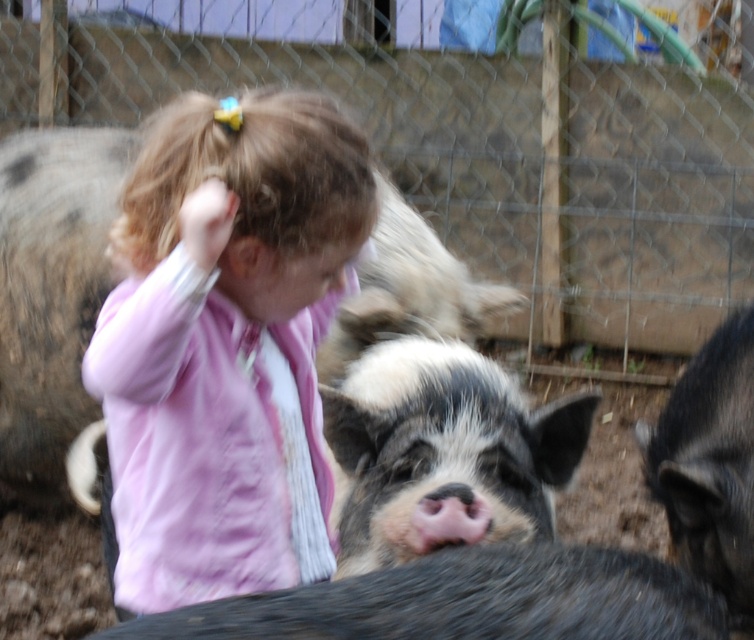
Between black fuzzy pig at center and black fuzzy pig at lower right, which one is positioned higher?

black fuzzy pig at lower right is higher up.

Is black fuzzy pig at center taller than black fuzzy pig at lower right?

No, black fuzzy pig at center is not taller than black fuzzy pig at lower right.

Who is more distant from viewer, (287, 632) or (722, 452)?

Positioned behind is point (722, 452).

Image resolution: width=754 pixels, height=640 pixels. Identify the location of black fuzzy pig at center. (466, 602).

Who is shorter, pink fabric at center or black fuzzy pig at center?

black fuzzy pig at center is shorter.

Can you confirm if pink fabric at center is shorter than black fuzzy pig at center?

Incorrect, pink fabric at center's height does not fall short of black fuzzy pig at center's.

You are a GUI agent. You are given a task and a screenshot of the screen. Output one action in this format:
    pyautogui.click(x=<x>, y=<y>)
    Task: Click on the pink fabric at center
    
    Given the screenshot: What is the action you would take?
    pyautogui.click(x=225, y=342)

In order to click on pink fabric at center in this screenshot , I will do `click(225, 342)`.

Is point (581, 449) closer to camera compared to point (494, 625)?

No.

Who is taller, speckled fur pig at center or black fuzzy pig at center?

With more height is speckled fur pig at center.

Does point (543, 406) lie behind point (127, 637)?

Yes, point (543, 406) is farther from viewer.

In order to click on speckled fur pig at center in this screenshot , I will do `click(443, 452)`.